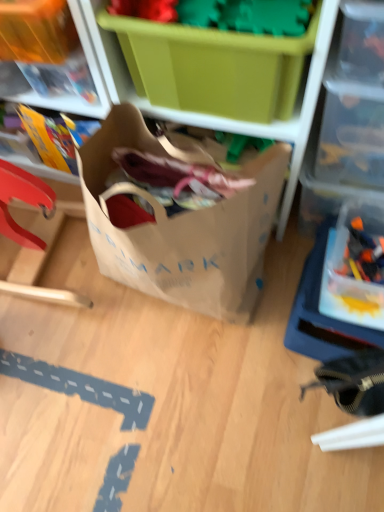
Question: Is transparent plastic storage box at right, which appears as the 3th storage box when viewed from the left, directly adjacent to brown paper bag at center?

Choices:
 (A) no
 (B) yes

Answer: (A)

Question: Can you confirm if transparent plastic storage box at right, which appears as the 1th storage box when viewed from the right, is smaller than brown paper bag at center?

Choices:
 (A) no
 (B) yes

Answer: (B)

Question: Does transparent plastic storage box at right, which appears as the 1th storage box when viewed from the right, come behind brown paper bag at center?

Choices:
 (A) no
 (B) yes

Answer: (B)

Question: From a real-world perspective, is transparent plastic storage box at right, which appears as the 1th storage box when viewed from the right, physically below brown paper bag at center?

Choices:
 (A) no
 (B) yes

Answer: (B)

Question: Considering the relative sizes of transparent plastic storage box at right, which appears as the 3th storage box when viewed from the left, and brown paper bag at center in the image provided, is transparent plastic storage box at right, which appears as the 3th storage box when viewed from the left, wider than brown paper bag at center?

Choices:
 (A) yes
 (B) no

Answer: (B)

Question: Is matte plastic storage box at upper left, which appears as the third storage box when viewed from the right, bigger or smaller than translucent plastic toy at right?

Choices:
 (A) big
 (B) small

Answer: (A)

Question: Is matte plastic storage box at upper left, the 1th storage box when ordered from left to right, inside or outside of translucent plastic toy at right?

Choices:
 (A) inside
 (B) outside

Answer: (B)

Question: In terms of height, does matte plastic storage box at upper left, which appears as the third storage box when viewed from the right, look taller or shorter compared to translucent plastic toy at right?

Choices:
 (A) tall
 (B) short

Answer: (A)

Question: Considering their positions, is matte plastic storage box at upper left, the 1th storage box when ordered from left to right, located in front of or behind translucent plastic toy at right?

Choices:
 (A) behind
 (B) front

Answer: (B)

Question: Is transparent plastic storage box at right, which appears as the 1th storage box when viewed from the right, taller or shorter than transparent plastic container at upper right?

Choices:
 (A) short
 (B) tall

Answer: (A)

Question: Is point (344, 233) closer or farther from the camera than point (379, 78)?

Choices:
 (A) farther
 (B) closer

Answer: (A)

Question: Visually, is transparent plastic storage box at right, which appears as the 1th storage box when viewed from the right, positioned to the left or to the right of transparent plastic container at upper right?

Choices:
 (A) right
 (B) left

Answer: (A)

Question: Based on their sizes in the image, would you say transparent plastic storage box at right, which appears as the 3th storage box when viewed from the left, is bigger or smaller than transparent plastic container at upper right?

Choices:
 (A) small
 (B) big

Answer: (A)

Question: Is matte plastic storage box at upper left, the 1th storage box when ordered from left to right, inside the boundaries of transparent plastic storage box at right, which appears as the 3th storage box when viewed from the left, or outside?

Choices:
 (A) outside
 (B) inside

Answer: (A)

Question: In terms of width, does matte plastic storage box at upper left, the 1th storage box when ordered from left to right, look wider or thinner when compared to transparent plastic storage box at right, which appears as the 1th storage box when viewed from the right?

Choices:
 (A) wide
 (B) thin

Answer: (B)